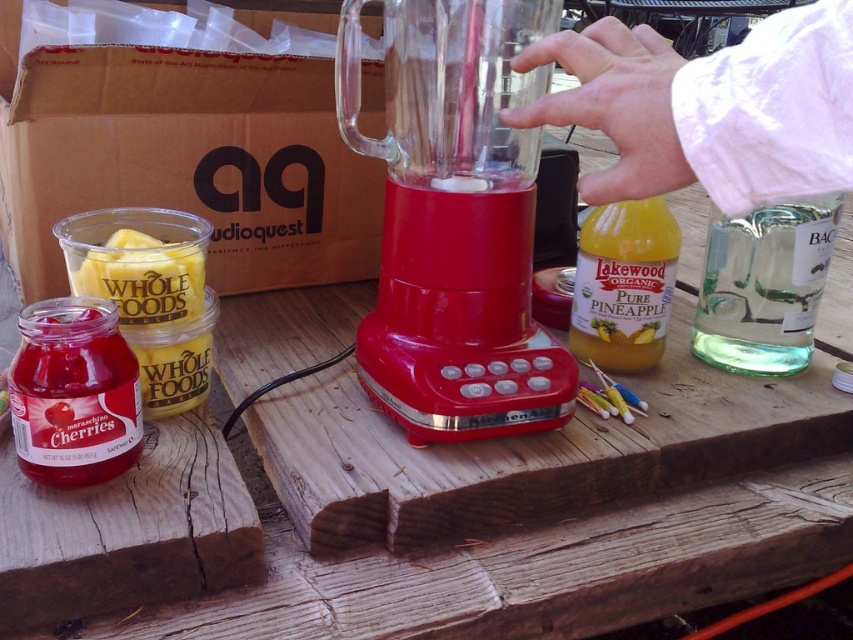
Which is more to the left, red plastic blender at center or clear plastic blender at center?

Positioned to the left is red plastic blender at center.

Identify the location of red plastic blender at center. (456, 221).

In order to click on red plastic blender at center in this screenshot , I will do [456, 221].

Is point (740, 140) in front of point (595, 259)?

Yes.

Between clear plastic blender at center and translucent glass bottle of pure pineapple juice at center-right, which one appears on the right side from the viewer's perspective?

Positioned to the right is translucent glass bottle of pure pineapple juice at center-right.

Is point (520, 60) less distant than point (621, 308)?

That is True.

I want to click on clear plastic blender at center, so click(711, 108).

Is point (445, 32) behind point (793, 209)?

No, it is not.

Can you confirm if red plastic blender at center is thinner than clear glass at right?

In fact, red plastic blender at center might be wider than clear glass at right.

At what (x,y) coordinates should I click in order to perform the action: click on red plastic blender at center. Please return your answer as a coordinate pair (x, y). Looking at the image, I should click on (456, 221).